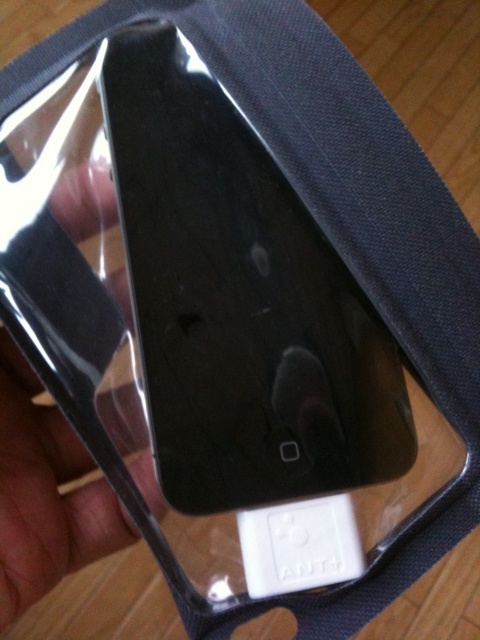
You are holding a transparent plastic hand at center and a white plastic ipod at center. Which object is closer to you?

The transparent plastic hand at center is closer to you because it is in front of the white plastic ipod at center.

You are holding a black electronic device in its packaging and notice two points marked on the sleeve. The first point is at coordinates point (34, 397) and the second at point (285, 545). From your perspective, which point is closer to you?

Point (285, 545) is closer to you because point (34, 397) is behind it.

You are holding a transparent plastic hand at center and a white plastic ipod at center. Which object has a greater width?

The transparent plastic hand at center has a greater width than the white plastic ipod at center.